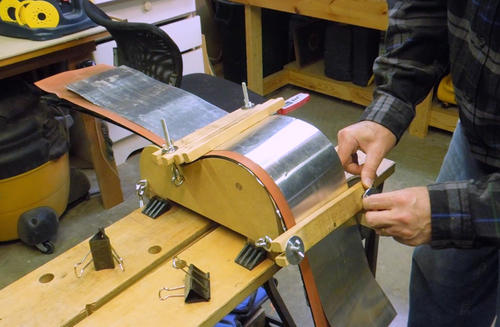
This screenshot has height=327, width=500. I want to click on workbenches, so click(253, 32), click(338, 3), click(428, 122), click(148, 258), click(134, 297), click(20, 69).